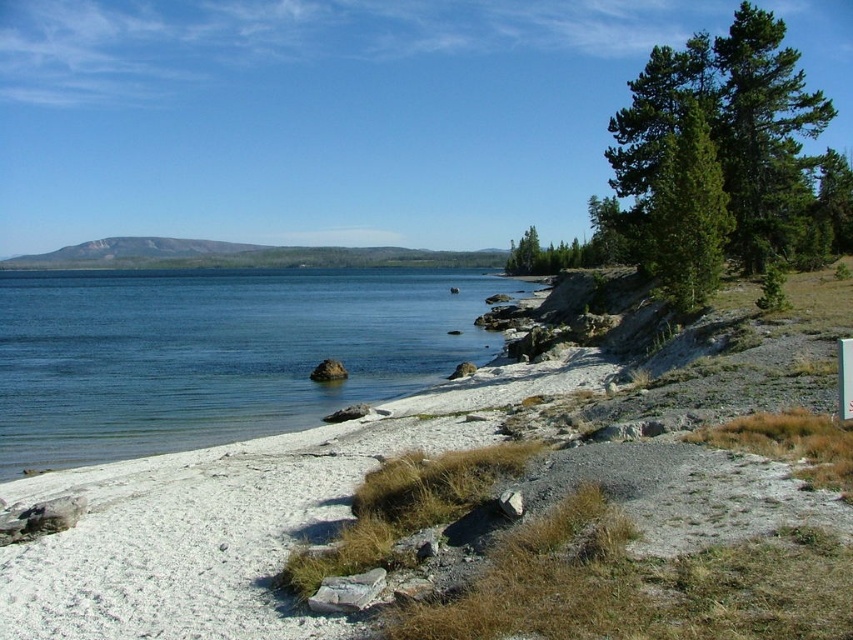
Question: Which object is positioned closest to the green textured pine tree at upper right?

Choices:
 (A) blue water at lower left
 (B) white gravelly sand at lower left

Answer: (B)

Question: Does blue water at lower left appear on the right side of green textured pine tree at upper right?

Choices:
 (A) no
 (B) yes

Answer: (A)

Question: Does white gravelly sand at lower left come in front of green textured pine tree at upper right?

Choices:
 (A) no
 (B) yes

Answer: (B)

Question: Can you confirm if white gravelly sand at lower left is thinner than green textured pine tree at upper right?

Choices:
 (A) yes
 (B) no

Answer: (B)

Question: Estimate the real-world distances between objects in this image. Which object is farther from the green textured pine tree at upper right?

Choices:
 (A) white gravelly sand at lower left
 (B) blue water at lower left

Answer: (B)

Question: Which object is positioned farthest from the blue water at lower left?

Choices:
 (A) green textured pine tree at upper right
 (B) white gravelly sand at lower left

Answer: (A)